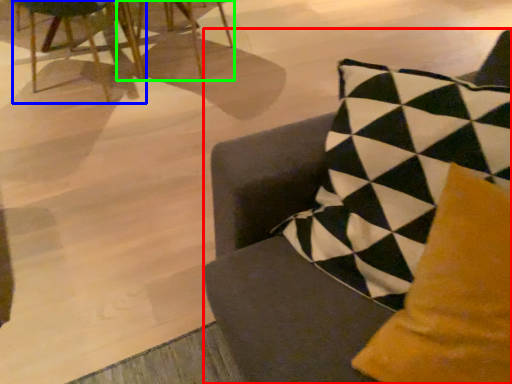
Question: Which object is the closest to the chair (highlighted by a red box)? Choose among these: chair (highlighted by a blue box) or chair (highlighted by a green box).

Choices:
 (A) chair
 (B) chair

Answer: (A)